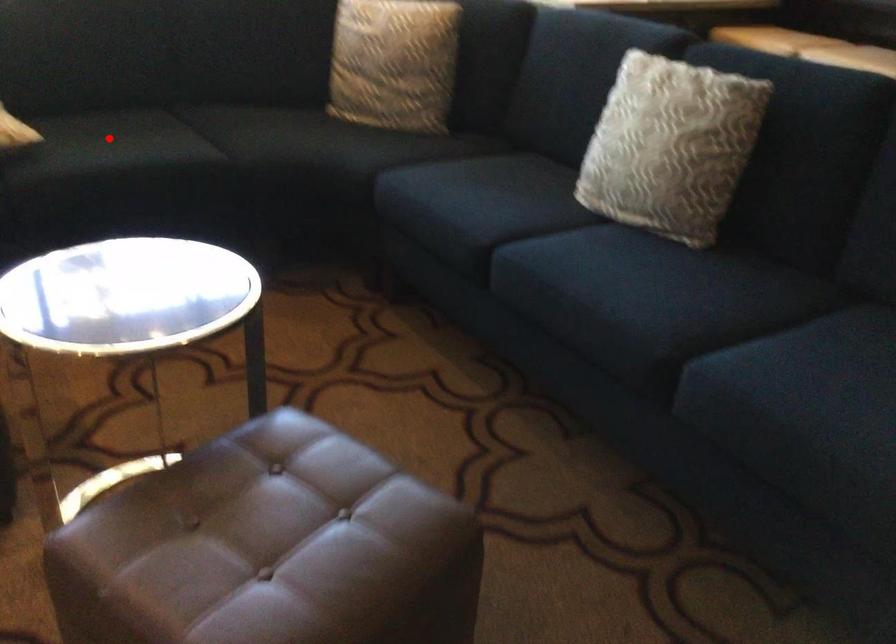
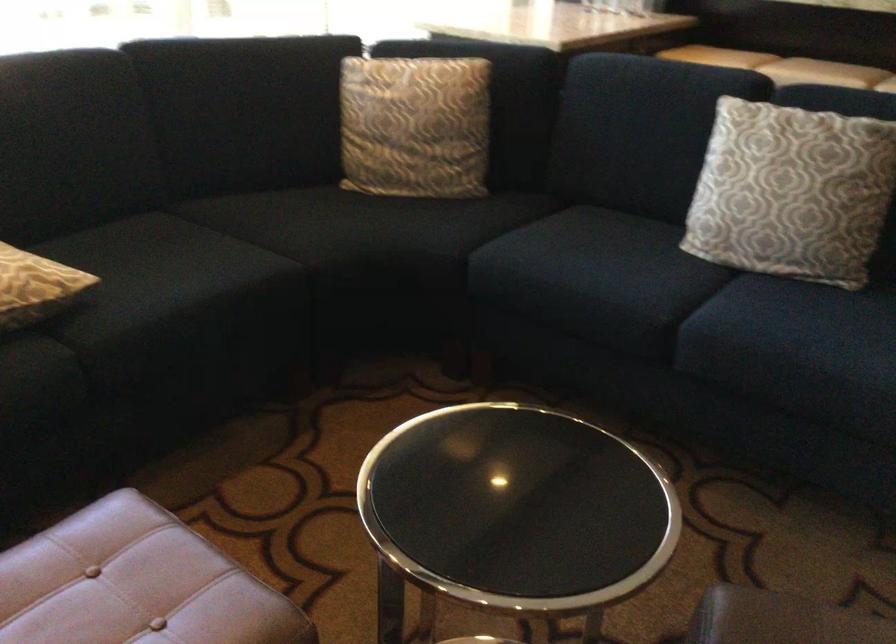
Question: I am providing you with two images of the same scene from different viewpoints. A red point is marked on the first image. Is the red point's position out of view in image 2?

Choices:
 (A) Yes
 (B) No

Answer: (B)